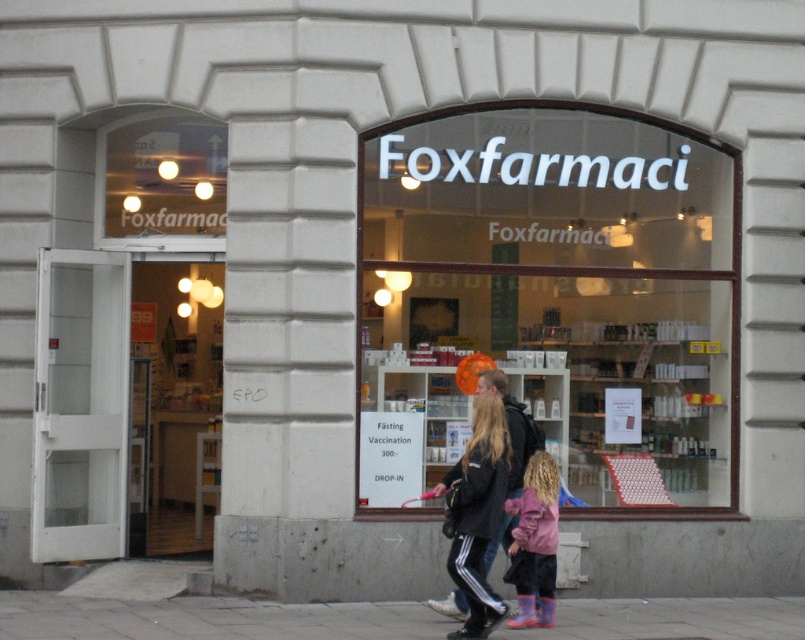
Is gray concrete pavement at lower center thinner than pink fabric coat at center?

In fact, gray concrete pavement at lower center might be wider than pink fabric coat at center.

Measure the distance between point (x=399, y=609) and camera.

Point (x=399, y=609) and camera are 11.89 meters apart from each other.

This screenshot has height=640, width=805. What do you see at coordinates (209, 618) in the screenshot?
I see `gray concrete pavement at lower center` at bounding box center [209, 618].

Identify the location of gray concrete pavement at lower center. The image size is (805, 640). (209, 618).

Is gray concrete pavement at lower center shorter than pink matte jacket at lower center?

Correct, gray concrete pavement at lower center is not as tall as pink matte jacket at lower center.

Who is taller, gray concrete pavement at lower center or pink matte jacket at lower center?

With more height is pink matte jacket at lower center.

Where is `gray concrete pavement at lower center`? Image resolution: width=805 pixels, height=640 pixels. gray concrete pavement at lower center is located at coordinates (209, 618).

Is matte glass window at center above gray concrete pavement at lower center?

Indeed, matte glass window at center is positioned over gray concrete pavement at lower center.

This screenshot has width=805, height=640. What do you see at coordinates (550, 300) in the screenshot?
I see `matte glass window at center` at bounding box center [550, 300].

This screenshot has width=805, height=640. I want to click on matte glass window at center, so click(x=550, y=300).